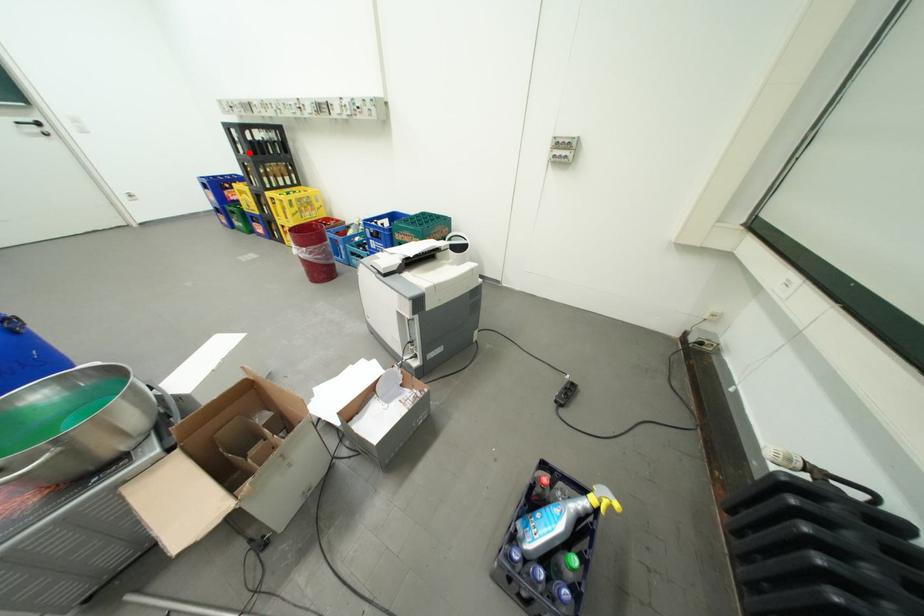
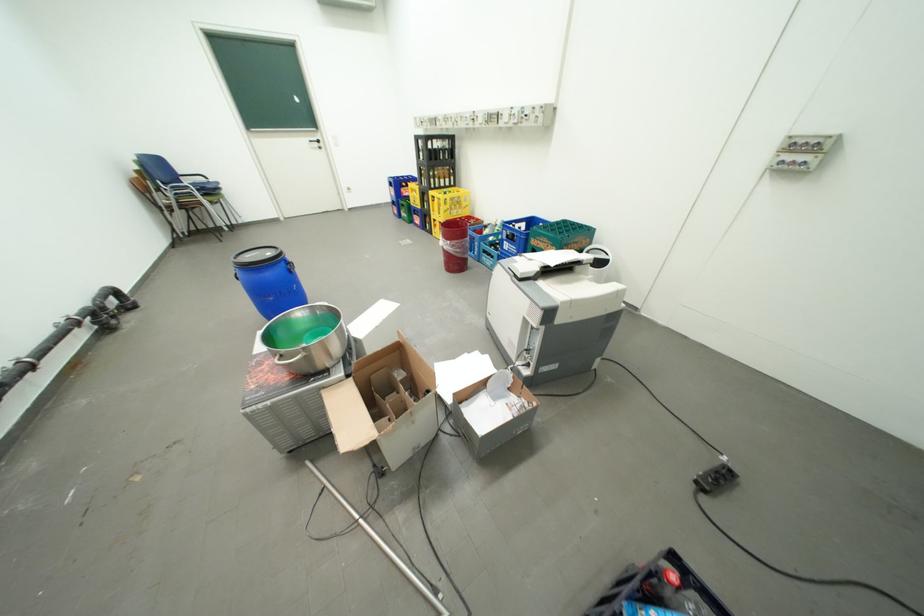
Question: A red point is marked in image1. In image2, is the corresponding 3D point closer to the camera or farther? Reply with the corresponding letter.

Choices:
 (A) The corresponding 3D point is closer.
 (B) The corresponding 3D point is farther.

Answer: (A)